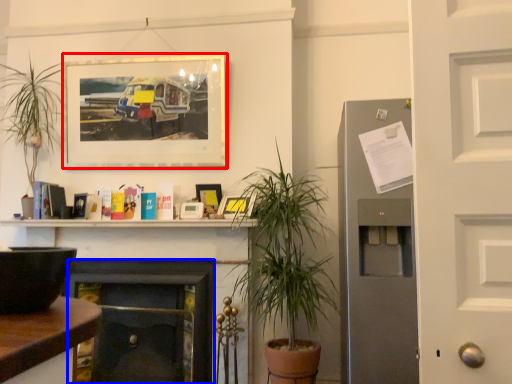
Question: Among these objects, which one is nearest to the camera, picture frame (highlighted by a red box) or fireplace (highlighted by a blue box)?

Choices:
 (A) picture frame
 (B) fireplace

Answer: (B)